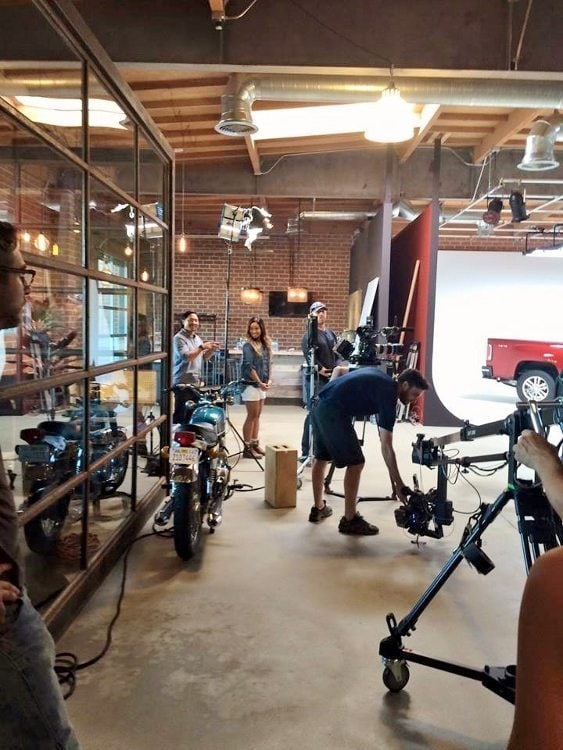
The height and width of the screenshot is (750, 563). Identify the location of overhead lights. (404, 114), (494, 201), (513, 208), (531, 238), (190, 231), (245, 289), (303, 294).